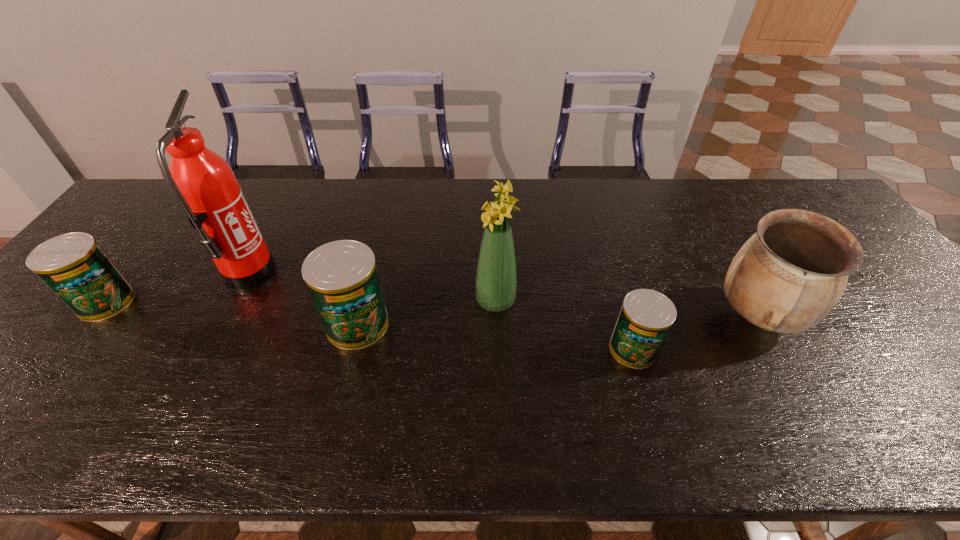
This screenshot has width=960, height=540. I want to click on the leftmost object, so click(76, 269).

This screenshot has height=540, width=960. In order to click on the fifth tallest object in this screenshot , I will do `click(76, 269)`.

Where is `the second can from right to left`? the second can from right to left is located at coordinates (342, 278).

Where is `the shortest can`? the shortest can is located at coordinates (646, 316).

This screenshot has width=960, height=540. I want to click on the rightmost can, so click(646, 316).

Locate an element on the screen. This screenshot has height=540, width=960. the second object from left to right is located at coordinates (203, 183).

Locate an element on the screen. This screenshot has width=960, height=540. the tallest object is located at coordinates (203, 183).

Locate an element on the screen. This screenshot has width=960, height=540. the second tallest object is located at coordinates (496, 280).

In order to click on bouquet in this screenshot , I will do `click(496, 280)`.

Find the location of a particular element. The width and height of the screenshot is (960, 540). the rightmost object is located at coordinates (789, 275).